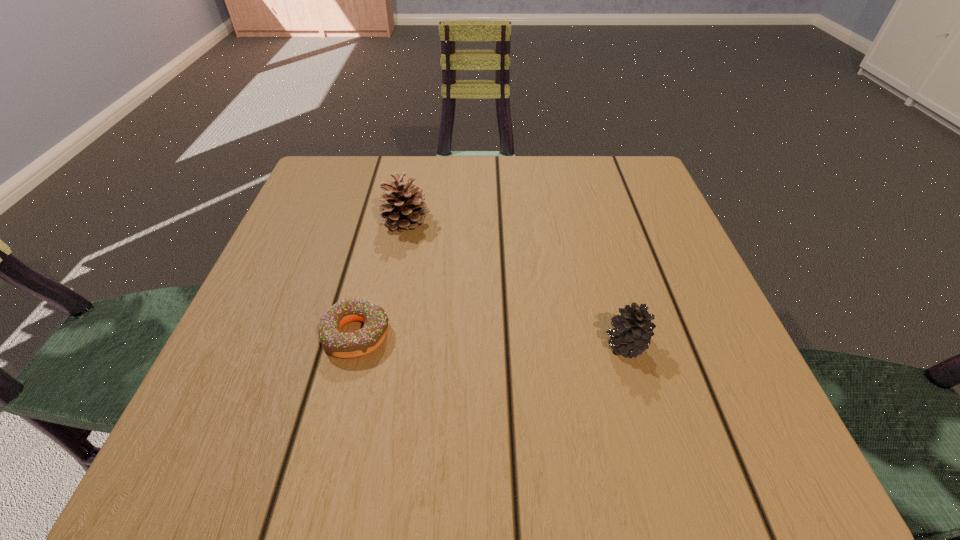
In order to click on the tallest object in this screenshot , I will do `click(406, 210)`.

You are a GUI agent. You are given a task and a screenshot of the screen. Output one action in this format:
    pyautogui.click(x=<x>, y=<y>)
    Task: Click on the left pinecone
    The image size is (960, 540).
    Given the screenshot: What is the action you would take?
    pyautogui.click(x=406, y=210)

Identify the location of the second shortest object. (633, 330).

The height and width of the screenshot is (540, 960). I want to click on the nearer pinecone, so point(633,330).

Where is `the shortest object`? The width and height of the screenshot is (960, 540). the shortest object is located at coordinates (339, 344).

Locate an element on the screen. This screenshot has height=540, width=960. vacant space located 0.380m on the front of the tallest object is located at coordinates (370, 411).

Identify the location of free spot located on the front of the right pinecone. The image size is (960, 540). coord(661,468).

Where is `free location located 0.110m on the back of the doughnut`? The image size is (960, 540). free location located 0.110m on the back of the doughnut is located at coordinates (373, 265).

I want to click on object situated at the far edge, so click(406, 210).

At what (x,y) coordinates should I click in order to perform the action: click on object present at the left edge. Please return your answer as a coordinate pair (x, y). Looking at the image, I should click on (339, 344).